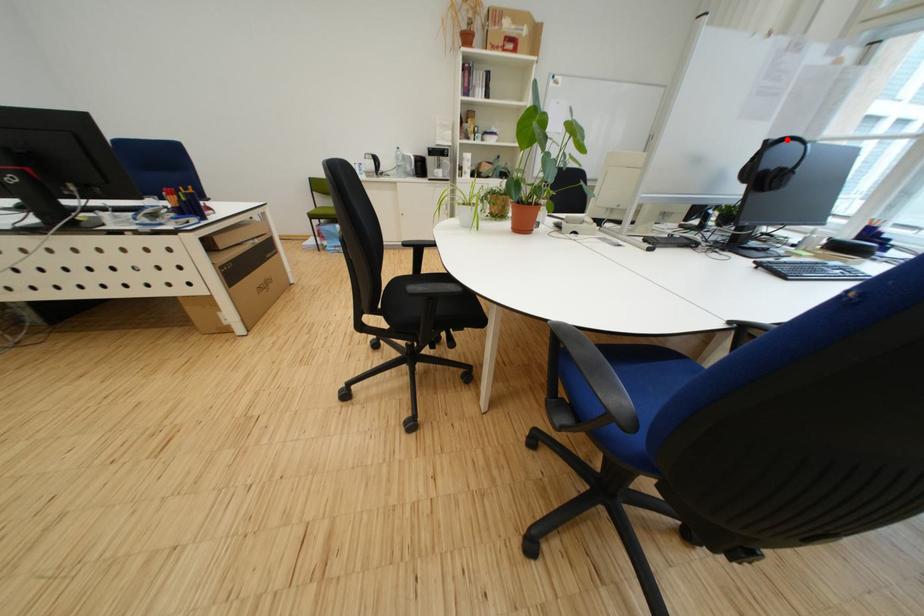
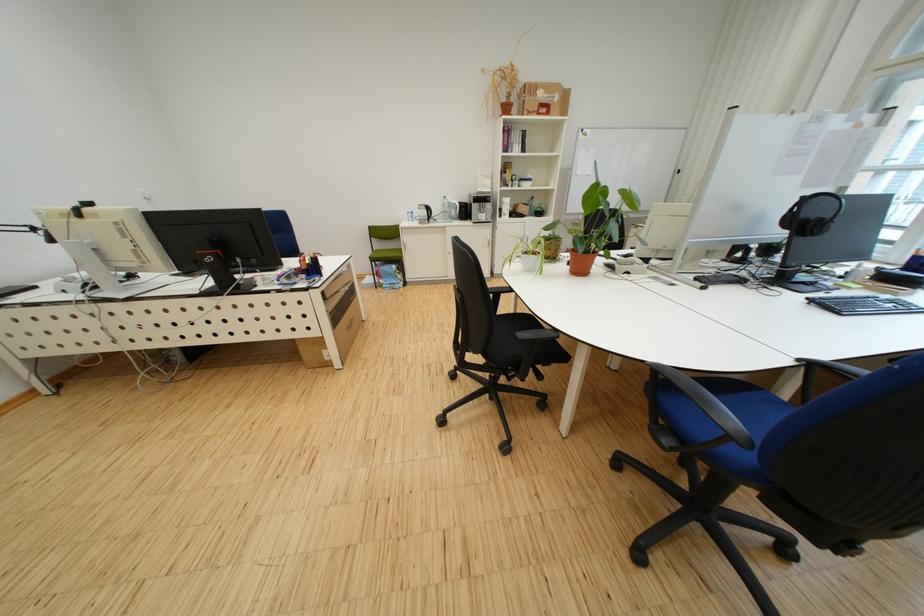
Find the pixel in the second image that matches the highlighted location in the first image.

(821, 196)